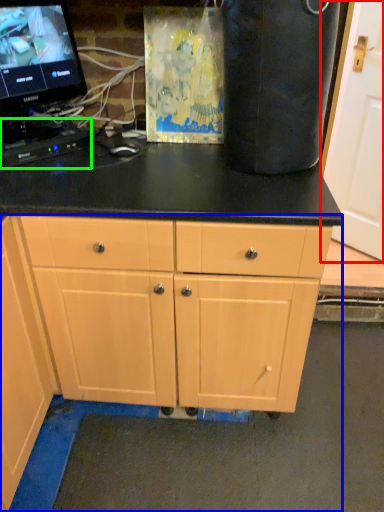
Question: Which object is the farthest from door (highlighted by a red box)? Choose among these: cabinet (highlighted by a blue box) or computer keyboard (highlighted by a green box).

Choices:
 (A) cabinet
 (B) computer keyboard

Answer: (A)